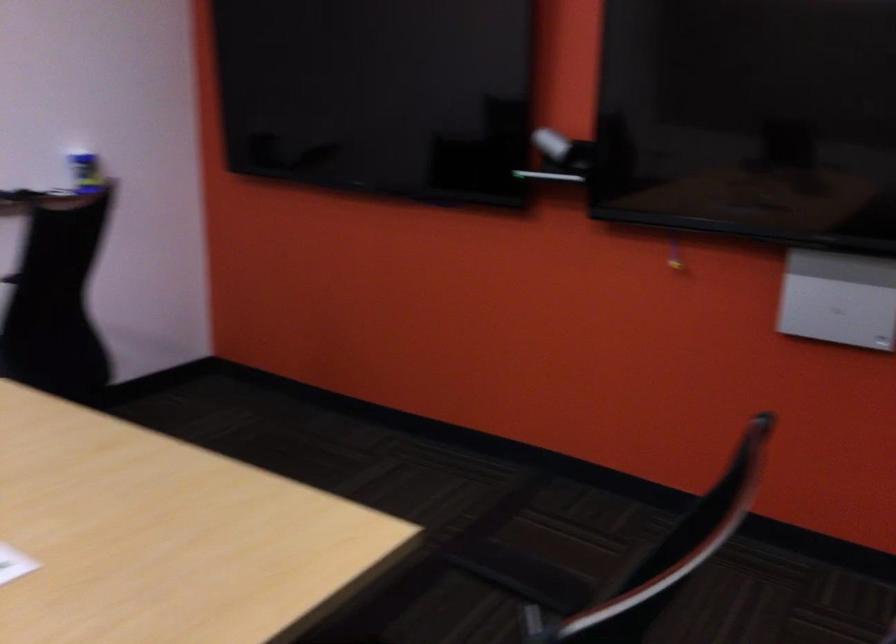
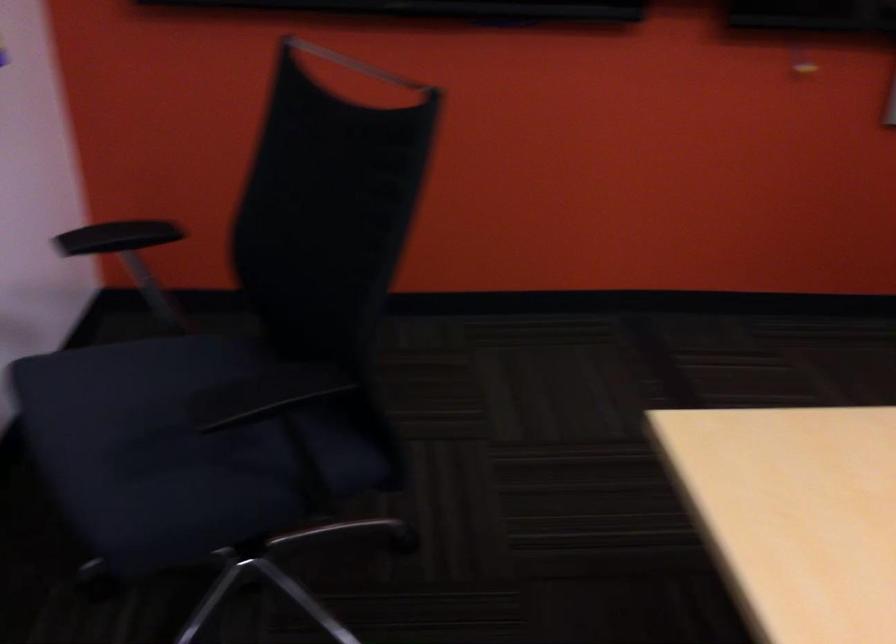
The point at (348, 213) is marked in the first image. Where is the corresponding point in the second image?

(356, 64)